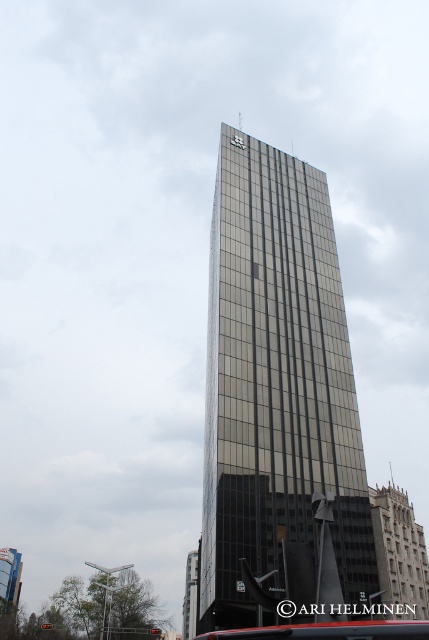
Question: Is reflective glass tower at center wider than metallic bus at center?

Choices:
 (A) no
 (B) yes

Answer: (B)

Question: Which of the following is the closest to the observer?

Choices:
 (A) reflective glass tower at center
 (B) metallic bus at center

Answer: (B)

Question: Does reflective glass tower at center have a greater width compared to metallic bus at center?

Choices:
 (A) no
 (B) yes

Answer: (B)

Question: Which point is closer to the camera?

Choices:
 (A) (210, 536)
 (B) (380, 630)

Answer: (B)

Question: Is reflective glass tower at center below metallic bus at center?

Choices:
 (A) yes
 (B) no

Answer: (B)

Question: Which point is farther to the camera?

Choices:
 (A) reflective glass tower at center
 (B) metallic bus at center

Answer: (A)